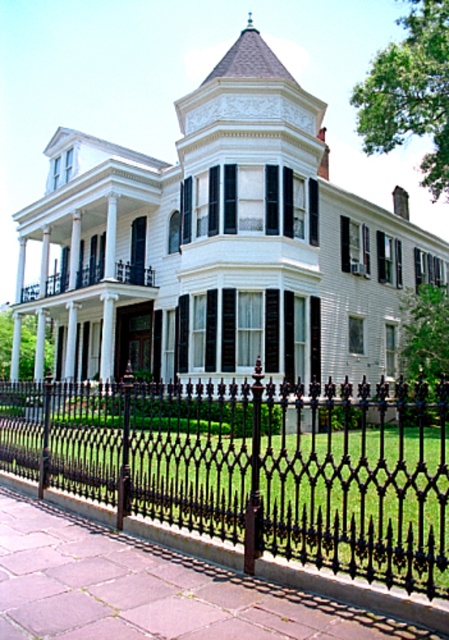
Question: Among these points, which one is farthest from the camera?

Choices:
 (A) (98, 273)
 (B) (32, 400)
 (C) (306, 257)

Answer: (A)

Question: Is white matte house at center to the left of black wrought iron fence at lower center from the viewer's perspective?

Choices:
 (A) no
 (B) yes

Answer: (B)

Question: Can you confirm if black wrought iron fence at lower center is smaller than white painted wood porch at center?

Choices:
 (A) no
 (B) yes

Answer: (A)

Question: Is black wrought iron fence at lower center below white painted wood porch at center?

Choices:
 (A) yes
 (B) no

Answer: (A)

Question: Which of the following is the farthest from the observer?

Choices:
 (A) [400, 560]
 (B) [52, 276]
 (C) [245, 304]

Answer: (B)

Question: Which object is positioned farthest from the black wrought iron fence at lower center?

Choices:
 (A) white painted wood porch at center
 (B) white matte house at center

Answer: (A)